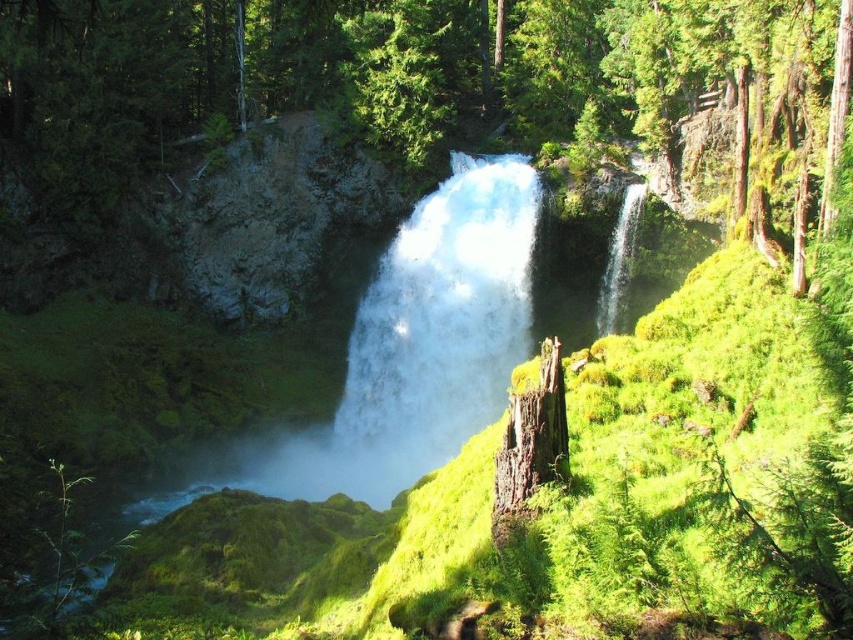
Question: Which object appears farthest from the camera in this image?

Choices:
 (A) brown rough wood stump at center
 (B) white frothy water at center

Answer: (B)

Question: Which point is closer to the camera taking this photo?

Choices:
 (A) (311, 84)
 (B) (518, 506)
 (C) (409, 381)

Answer: (B)

Question: Where is white frothy water at center located in relation to brown rough wood stump at center in the image?

Choices:
 (A) left
 (B) right

Answer: (A)

Question: Which of the following is the farthest from the observer?

Choices:
 (A) green mossy tree stump at center
 (B) brown rough wood stump at center
 (C) white frothy water at center

Answer: (C)

Question: From the image, what is the correct spatial relationship of white frothy water at center in relation to brown rough wood stump at center?

Choices:
 (A) left
 (B) right

Answer: (A)

Question: Does green mossy tree stump at center appear under brown rough wood stump at center?

Choices:
 (A) yes
 (B) no

Answer: (B)